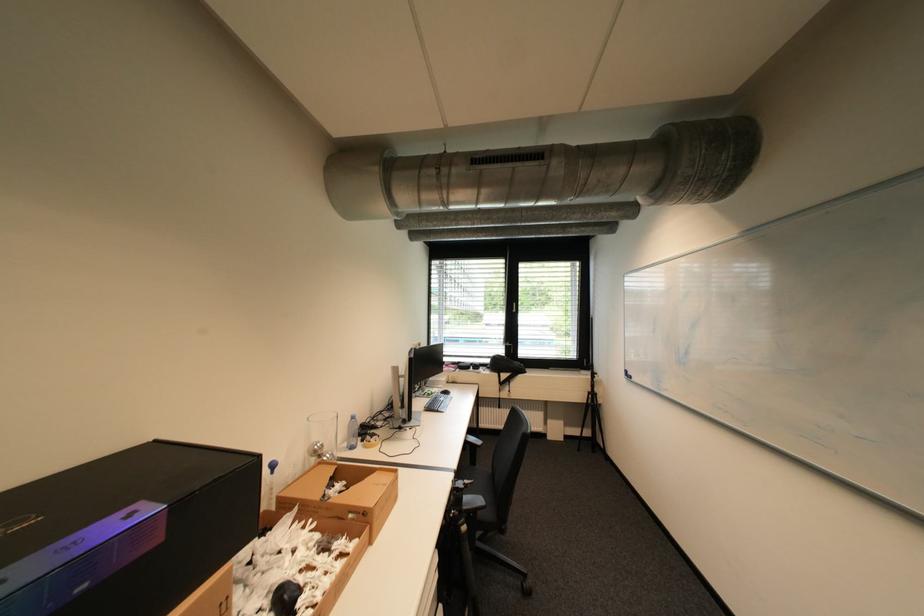
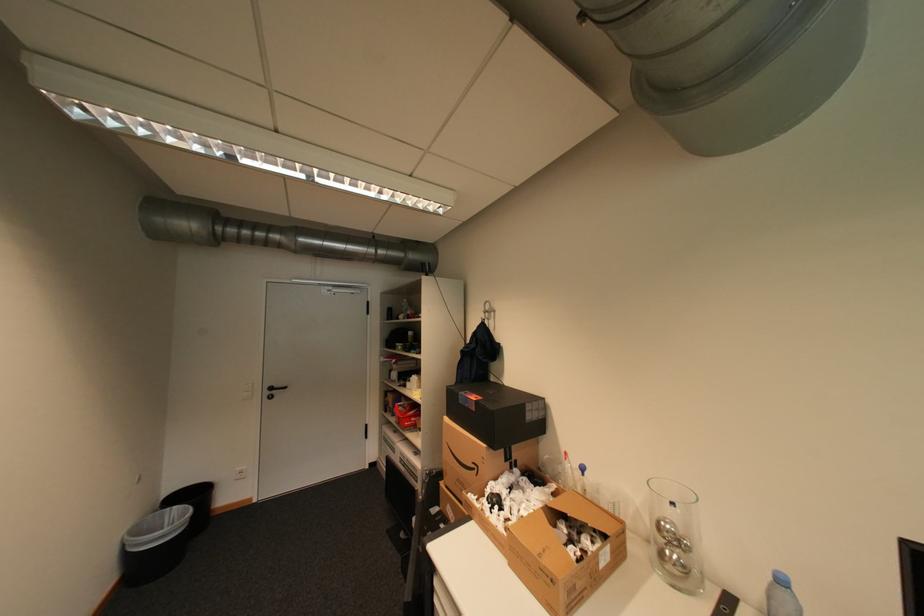
Locate, in the second image, the point that corresponds to pixel 326 447 in the first image.

(673, 527)